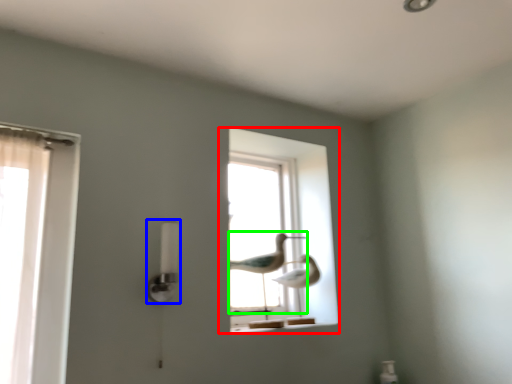
Question: Which object is the farthest from window (highlighted by a red box)? Choose among these: lamp (highlighted by a blue box) or bird (highlighted by a green box).

Choices:
 (A) lamp
 (B) bird

Answer: (A)